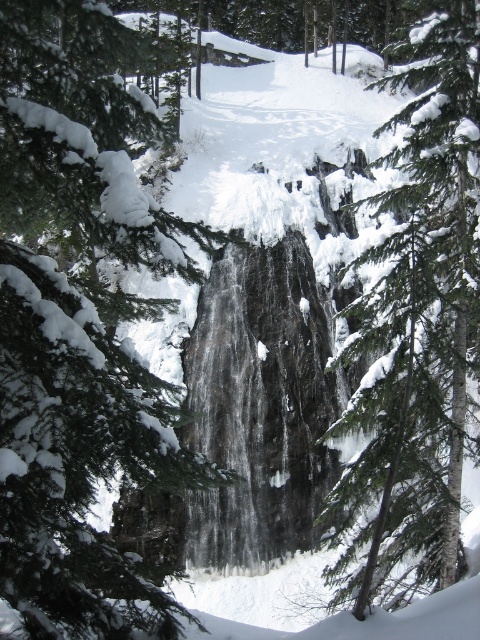
Who is positioned more to the right, green textured pine tree at center or green textured tree at center?

From the viewer's perspective, green textured tree at center appears more on the right side.

Is green textured pine tree at center in front of green textured tree at center?

No, green textured pine tree at center is behind green textured tree at center.

Locate an element on the screen. green textured pine tree at center is located at coordinates (80, 323).